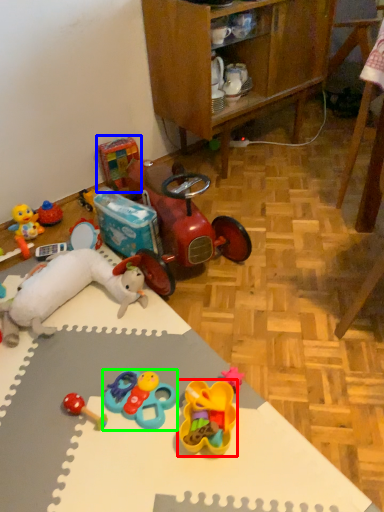
Question: Which object is positioned farthest from toy (highlighted by a red box)? Select from toy (highlighted by a blue box) and toy (highlighted by a green box).

Choices:
 (A) toy
 (B) toy

Answer: (A)